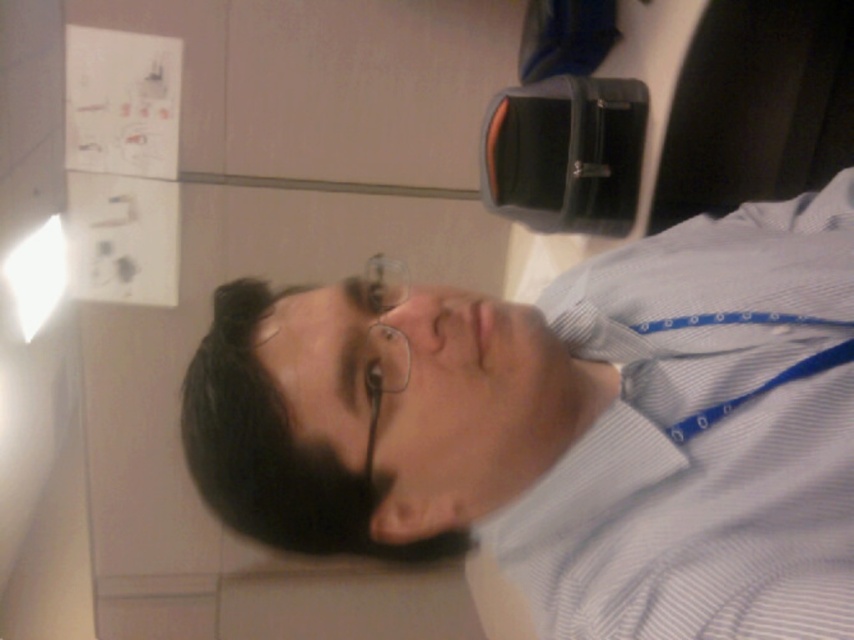
You are a photographer trying to capture a closeup of the clear plastic glasses at center. However, the white striped dress shirt at center is blocking your view. Can you adjust your position to get a clear shot without moving the objects?

The white striped dress shirt at center is in front of the clear plastic glasses at center, so moving your camera position slightly to the side or angle might allow you to see around the shirt to capture the glasses without moving the objects.

You are an observer in the conference room. You notice the white striped dress shirt at center and the clear plastic glasses at center. Which object is bigger in size?

The white striped dress shirt at center has a larger size compared to the clear plastic glasses at center, so the white striped dress shirt at center is bigger.

You are a photographer setting up for a portrait shoot in this room. You notice the white striped dress shirt at center and the clear plastic glasses at center. Which object should you adjust to ensure proper lighting since one is positioned in the shadow?

The clear plastic glasses at center should be adjusted because they are to the left of the white striped dress shirt at center, and the light source is coming from the left side, potentially casting a shadow on the shirt.